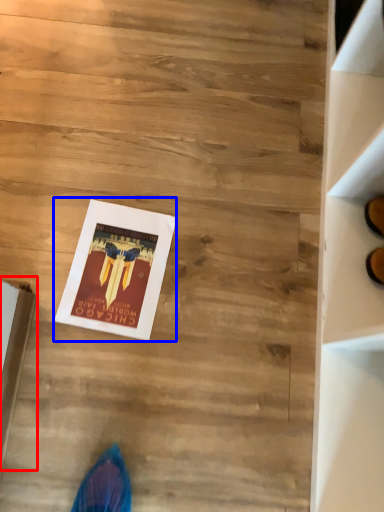
Question: Which point is further to the camera, cardboard box (highlighted by a red box) or magazine (highlighted by a blue box)?

Choices:
 (A) cardboard box
 (B) magazine

Answer: (B)